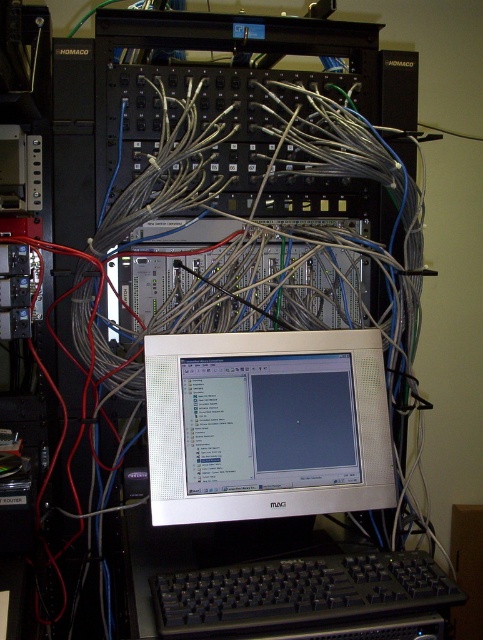
Question: Can you confirm if white glossy monitor at center is positioned to the right of black plastic keyboard at lower center?

Choices:
 (A) yes
 (B) no

Answer: (B)

Question: Which point is closer to the camera?

Choices:
 (A) black plastic keyboard at lower center
 (B) white glossy monitor at center

Answer: (A)

Question: Does white glossy monitor at center have a larger size compared to black plastic keyboard at lower center?

Choices:
 (A) yes
 (B) no

Answer: (A)

Question: Which of the following is the farthest from the observer?

Choices:
 (A) 271,620
 (B) 272,486

Answer: (B)

Question: Does white glossy monitor at center have a greater width compared to black plastic keyboard at lower center?

Choices:
 (A) no
 (B) yes

Answer: (A)